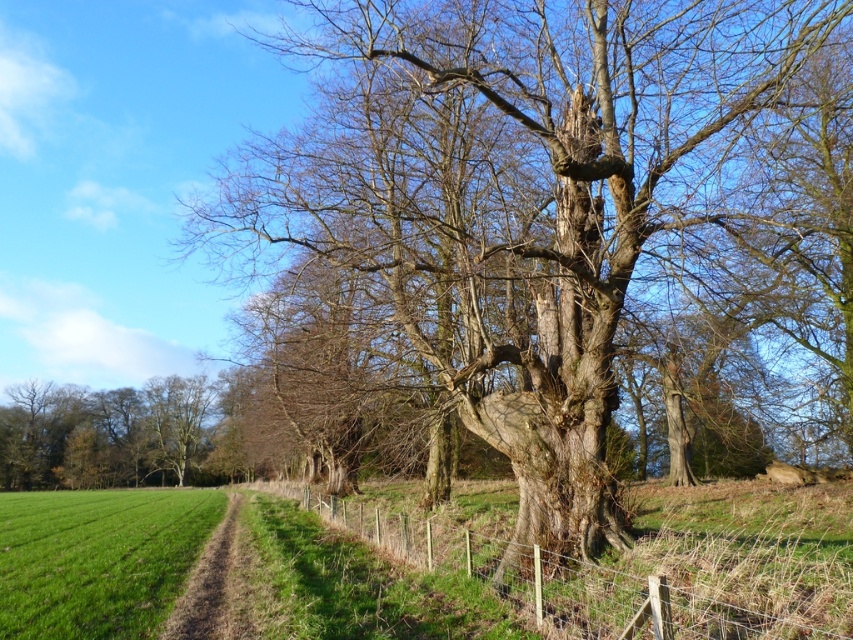
Which is more to the right, smooth bark tree at center or wooden wire at center?

Positioned to the right is smooth bark tree at center.

Can you confirm if smooth bark tree at center is positioned to the left of wooden wire at center?

Incorrect, smooth bark tree at center is not on the left side of wooden wire at center.

Where is `smooth bark tree at center`? The width and height of the screenshot is (853, 640). smooth bark tree at center is located at coordinates (525, 208).

Between smooth brown tree at lower left and brown dirt path at lower left, which one has less height?

brown dirt path at lower left

Who is more distant from viewer, (126, 426) or (213, 582)?

Positioned behind is point (126, 426).

Does point (26, 388) come behind point (215, 608)?

Yes, it is.

Where is `smooth brown tree at lower left`? The width and height of the screenshot is (853, 640). smooth brown tree at lower left is located at coordinates (100, 433).

This screenshot has width=853, height=640. Describe the element at coordinates (525, 208) in the screenshot. I see `smooth bark tree at center` at that location.

I want to click on smooth bark tree at center, so click(x=525, y=208).